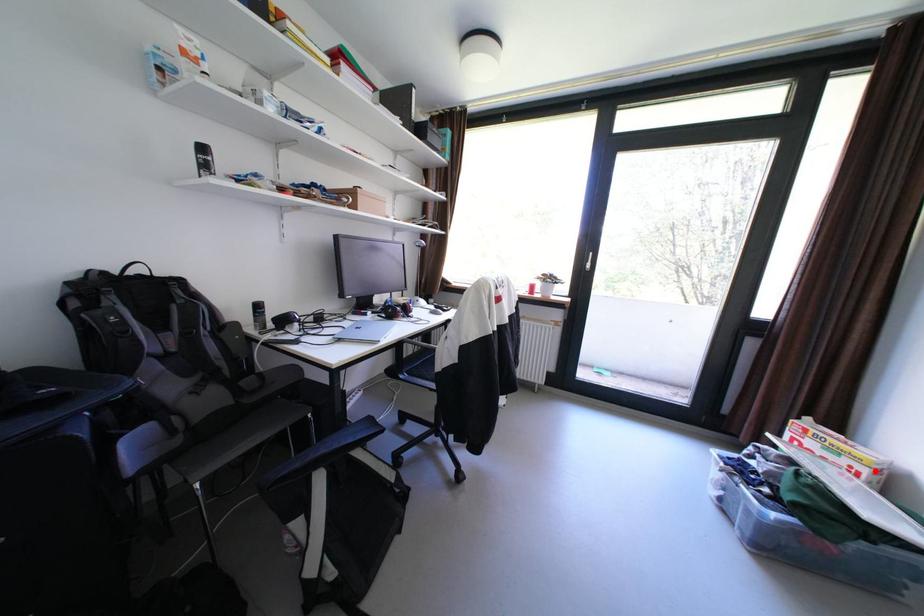
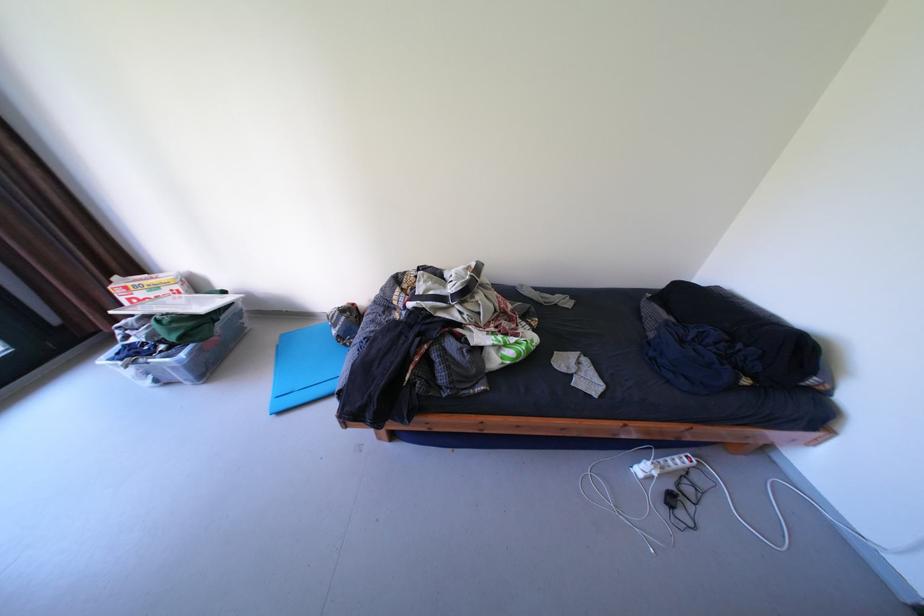
Question: I am providing you with two images of the same scene from different viewpoints. Given a red point in image1, look at the same physical point in image2. Is it:

Choices:
 (A) Closer to the viewpoint
 (B) Farther from the viewpoint

Answer: (A)